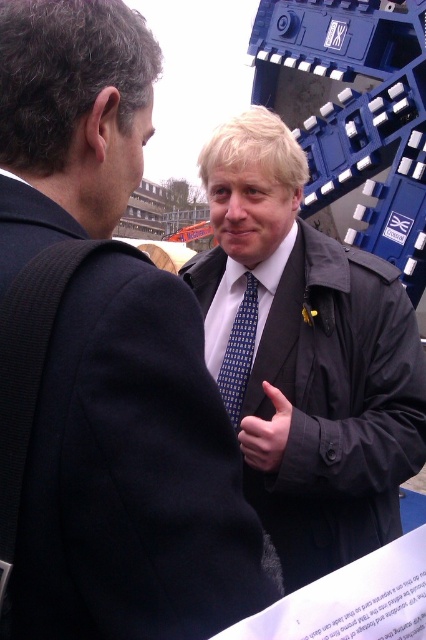
Question: Is blue dotted tie at center positioned in front of matte black hand at center?

Choices:
 (A) no
 (B) yes

Answer: (A)

Question: Which object is positioned closest to the blue dotted tie at center?

Choices:
 (A) matte black hand at center
 (B) matte black suit at center

Answer: (A)

Question: Which object is the farthest from the matte black hand at center?

Choices:
 (A) blue dotted tie at center
 (B) matte black jacket at center
 (C) matte black suit at center

Answer: (C)

Question: Does matte black suit at center appear on the right side of blue dotted tie at center?

Choices:
 (A) no
 (B) yes

Answer: (A)

Question: Among these objects, which one is nearest to the camera?

Choices:
 (A) blue dotted tie at center
 (B) matte black hand at center

Answer: (B)

Question: Is matte black suit at center to the right of matte black hand at center from the viewer's perspective?

Choices:
 (A) no
 (B) yes

Answer: (A)